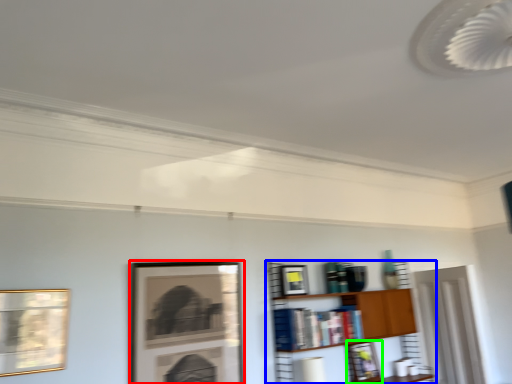
Question: Considering the real-world distances, which object is closest to picture frame (highlighted by a red box)? shelf (highlighted by a blue box) or picture frame (highlighted by a green box).

Choices:
 (A) shelf
 (B) picture frame

Answer: (A)